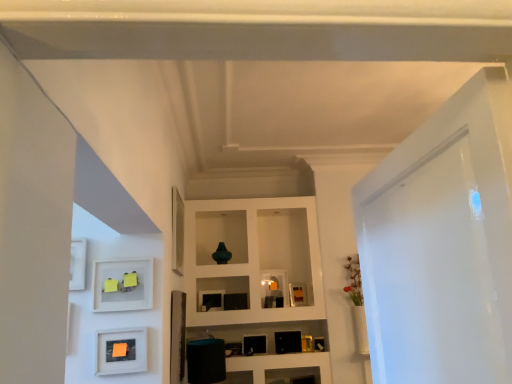
Question: Is point (365, 274) positioned closer to the camera than point (298, 292)?

Choices:
 (A) closer
 (B) farther

Answer: (A)

Question: Considering the relative positions of white glossy door at right and matte black picture frame at center, which appears as the 1th picture frame when viewed from the right, in the image provided, is white glossy door at right to the left or to the right of matte black picture frame at center, which appears as the 1th picture frame when viewed from the right,?

Choices:
 (A) right
 (B) left

Answer: (A)

Question: Considering the real-world distances, which object is farthest from the white glossy door at right?

Choices:
 (A) white matte frame at lower left
 (B) matte white picture frame at center, positioned as the 2th picture frame in front-to-back order
 (C) matte black picture frame at center, the third picture frame positioned from the left
 (D) matte orange paper at lower left, which is the 3th picture frame from back to front

Answer: (C)

Question: Which object is the closest to the white matte frame at lower left?

Choices:
 (A) matte white picture frame at center, the 2th picture frame from the back
 (B) matte black picture frame at center, the third picture frame positioned from the left
 (C) white glossy door at right
 (D) matte orange paper at lower left, which appears as the 1th picture frame when viewed from the front

Answer: (D)